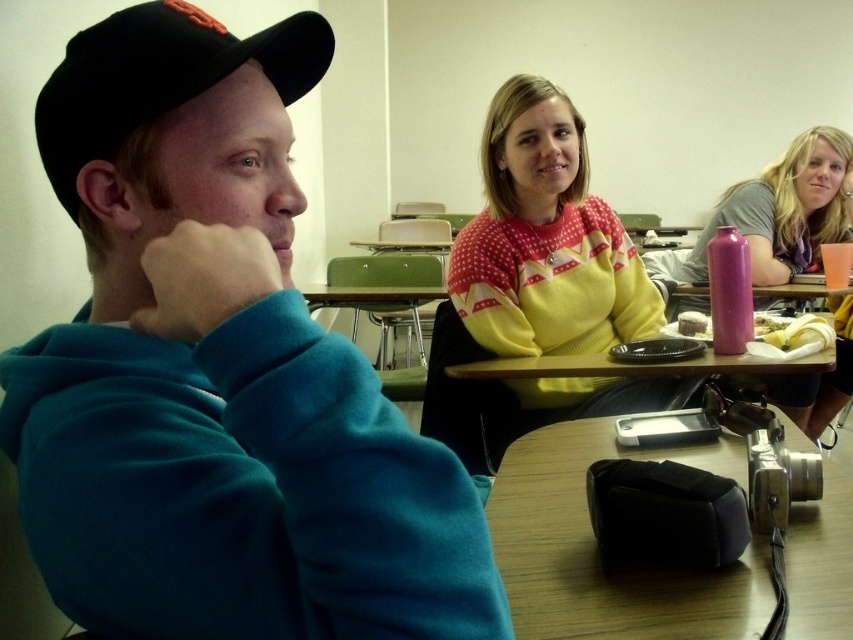
You are standing in the classroom and want to move from the point at coordinates [155,104] to the point at coordinates [837,294]. Can you walk directly between them without any obstacles?

The point at coordinates [155,104] is in front of the point at coordinates [837,294], so there is an obstacle blocking the path between them. You cannot walk directly between them without any obstacles.

You are a student sitting at the desk in the middle of the classroom. You need to reach for the pink matte water bottle at center to take a sip. Is the black fabric baseball cap at left in your way?

The black fabric baseball cap at left is to the left of the pink matte water bottle at center, so it is not blocking your path to the water bottle.